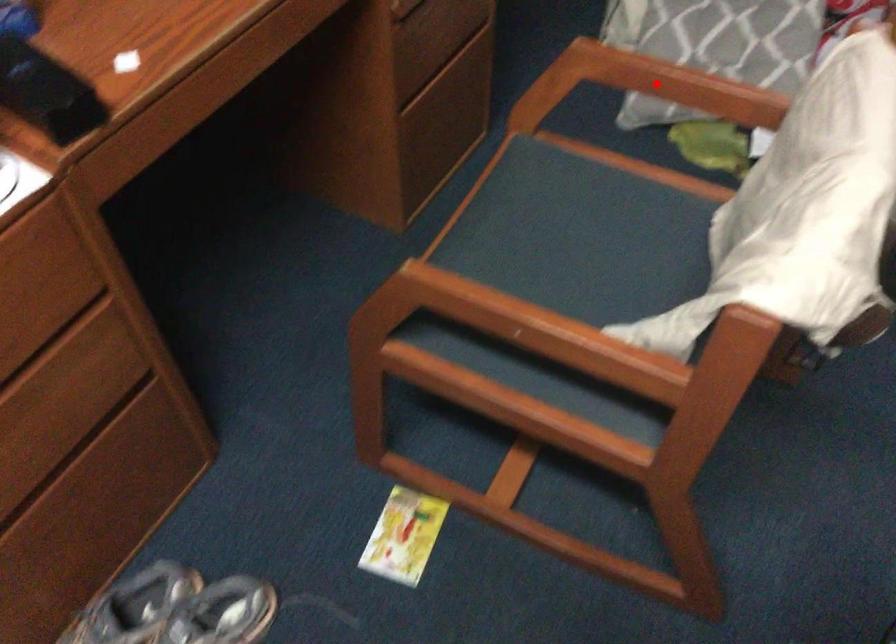
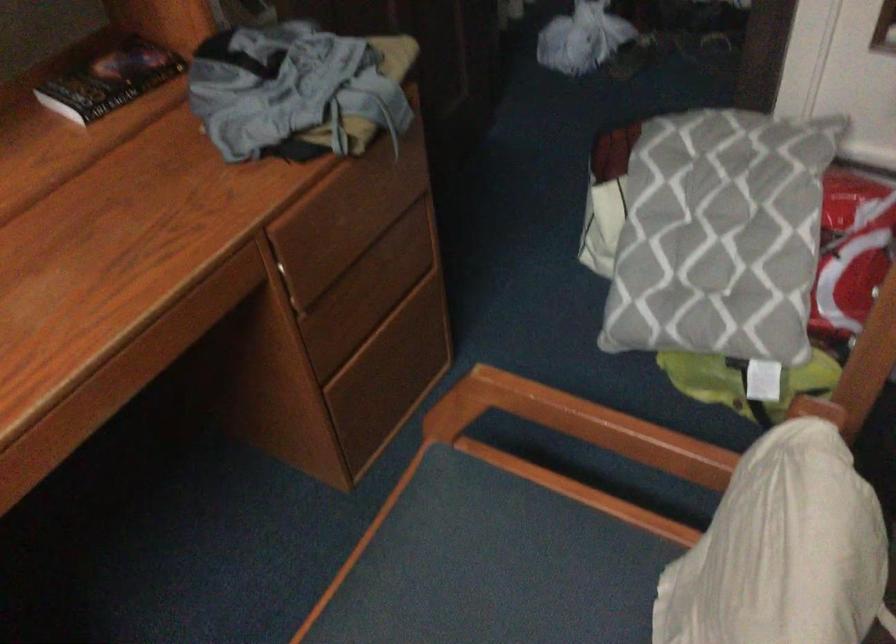
In the second image, find the point that corresponds to the highlighted location in the first image.

(579, 424)